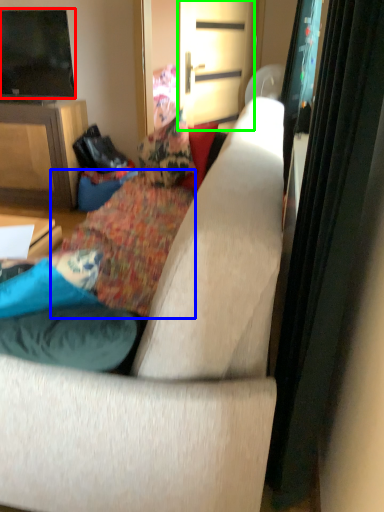
Question: Estimate the real-world distances between objects in this image. Which object is farther from television (highlighted by a red box), bedding (highlighted by a blue box) or screen door (highlighted by a green box)?

Choices:
 (A) bedding
 (B) screen door

Answer: (A)